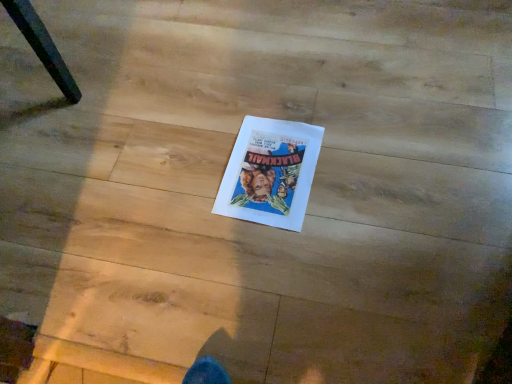
In order to click on free space above matte paper poster at center (from a real-world perspective) in this screenshot , I will do `click(279, 155)`.